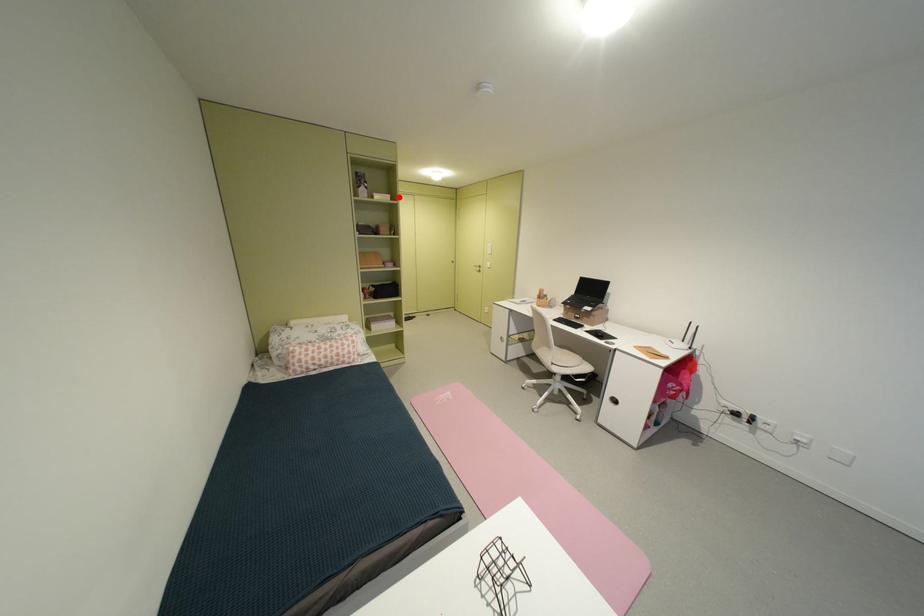
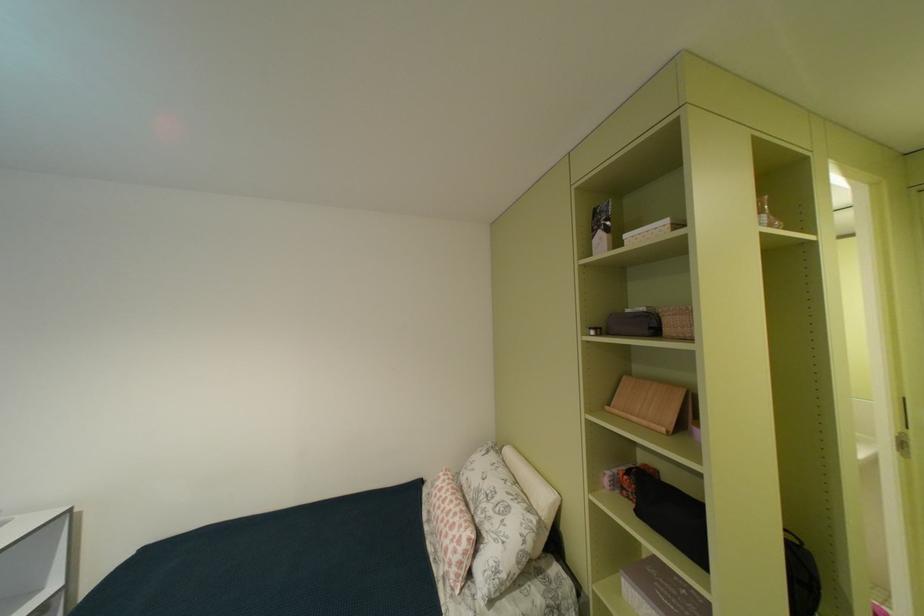
The point at the highlighted location is marked in the first image. Where is the corresponding point in the second image?

(676, 223)